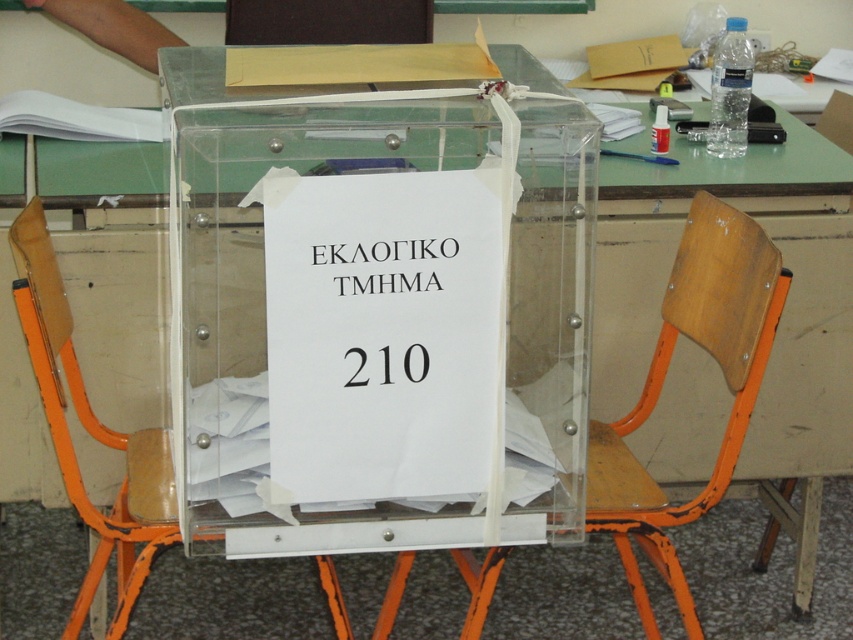
Does orange plastic chair at center have a smaller size compared to white paper at center?

Actually, orange plastic chair at center might be larger than white paper at center.

Consider the image. Who is taller, orange plastic chair at center or white paper at center?

orange plastic chair at center

Between point (67, 438) and point (421, 243), which one is positioned behind?

The point (67, 438) is behind.

Locate an element on the screen. Image resolution: width=853 pixels, height=640 pixels. orange plastic chair at center is located at coordinates (90, 432).

Does point (672, 321) come behind point (445, 250)?

That is True.

Is wooden at center thinner than white paper at center?

No, wooden at center is not thinner than white paper at center.

Who is more distant from viewer, [607,433] or [357,280]?

Positioned behind is point [607,433].

The height and width of the screenshot is (640, 853). In order to click on wooden at center in this screenshot , I will do `click(663, 378)`.

Between point (770, 294) and point (138, 435), which one is positioned in front?

Point (770, 294) is more forward.

Between point (621, 544) and point (91, 572), which one is positioned in front?

Point (91, 572) is more forward.

Image resolution: width=853 pixels, height=640 pixels. Identify the location of wooden at center. (663, 378).